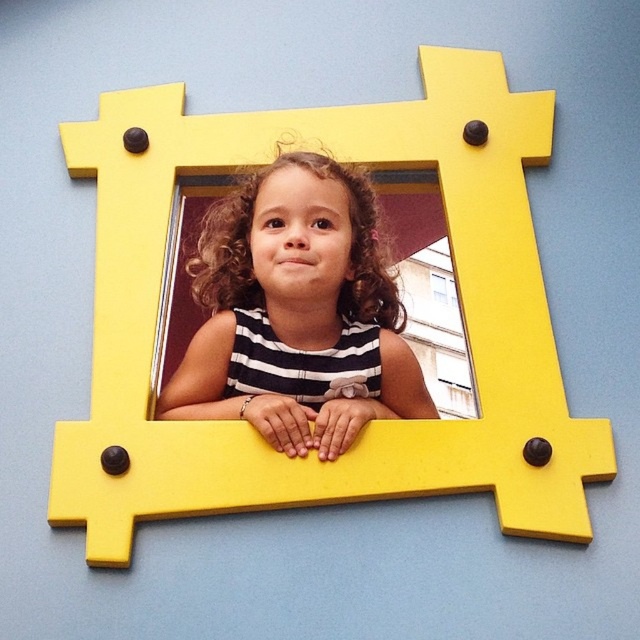
Is black striped shirt at center bigger than transparent glass window at center?

Yes, black striped shirt at center is bigger than transparent glass window at center.

Who is lower down, black striped shirt at center or transparent glass window at center?

black striped shirt at center

Locate an element on the screen. black striped shirt at center is located at coordinates (296, 314).